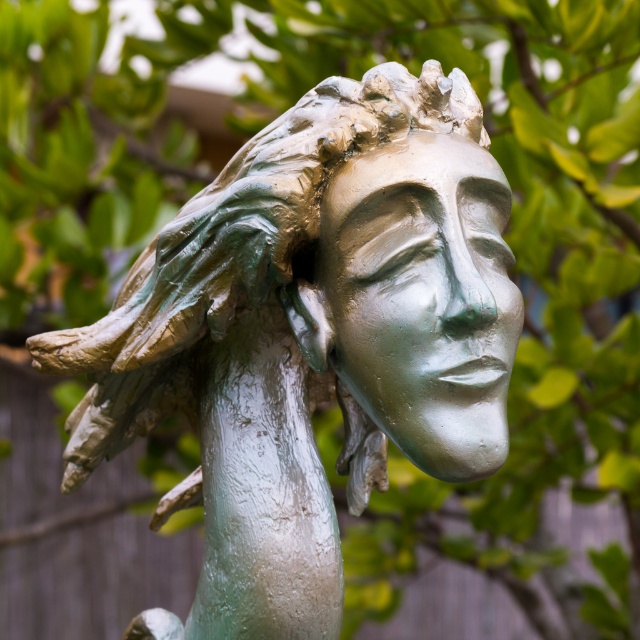
Is green patina statue at center taller than green patina face at center?

Correct, green patina statue at center is much taller as green patina face at center.

From the picture: Is green patina statue at center to the left of green patina face at center from the viewer's perspective?

Indeed, green patina statue at center is positioned on the left side of green patina face at center.

Locate an element on the screen. This screenshot has width=640, height=640. green patina statue at center is located at coordinates (310, 337).

Locate an element on the screen. The image size is (640, 640). green patina statue at center is located at coordinates (310, 337).